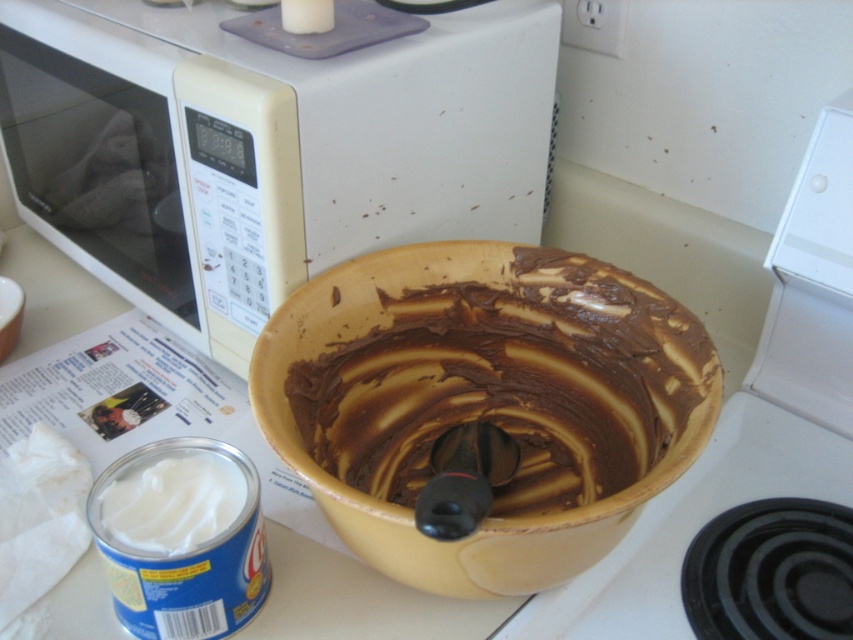
You are a chef preparing a dessert and need to know which container has more height to store ingredients. Based on the scene, which object between the yellow matte bowl at center and the white creamy frosting at lower left is taller?

The yellow matte bowl at center is taller than the white creamy frosting at lower left according to the description.

You are a chef preparing a cake and need to place the white creamy frosting into the yellow matte bowl at center. Based on their current positions, will you need to move the white creamy frosting at lower left upwards or downwards to reach the bowl?

The yellow matte bowl at center is located above the white creamy frosting at lower left, so you will need to move the white creamy frosting at lower left upwards to reach the bowl.

You are preparing to clean the kitchen and need to move the yellow matte bowl at center to the sink, which is behind the white plastic microwave at upper left. Can you move the bowl directly to the sink without moving any other items?

The white plastic microwave at upper left is located above the yellow matte bowl at center, so the bowl is below the microwave. Since the sink is behind the microwave, you would need to move the bowl around or past the microwave to reach the sink, which might require adjusting other items nearby.